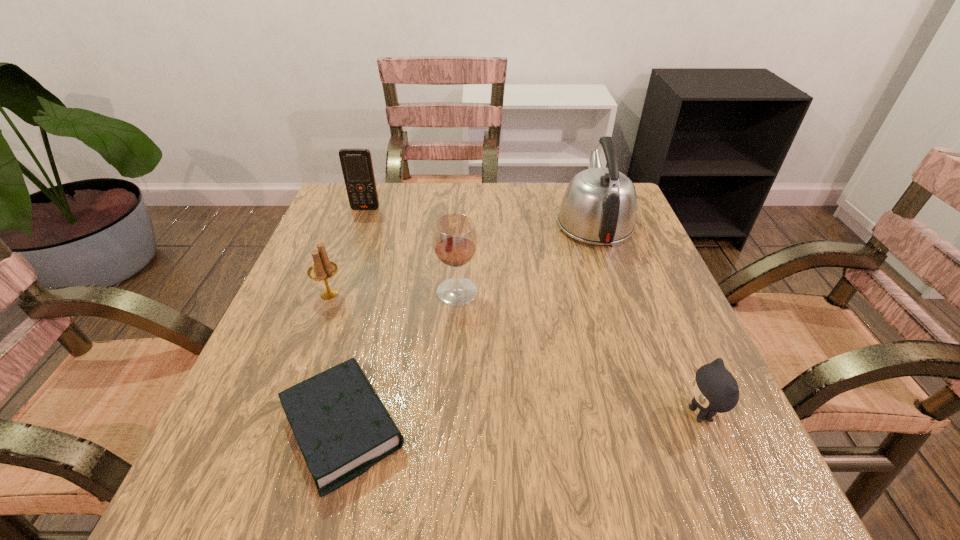
Identify the location of kettle. The width and height of the screenshot is (960, 540). (599, 206).

You are a GUI agent. You are given a task and a screenshot of the screen. Output one action in this format:
    pyautogui.click(x=<x>, y=<y>)
    Task: Click on the wineglass
    This screenshot has width=960, height=540.
    Given the screenshot: What is the action you would take?
    pyautogui.click(x=454, y=237)

Identify the location of cellular telephone. The image size is (960, 540). (356, 163).

Where is `candle holder`? The height and width of the screenshot is (540, 960). candle holder is located at coordinates (322, 269).

Where is `the fifth tallest object`? the fifth tallest object is located at coordinates (715, 390).

Find the location of a particular element. This screenshot has height=540, width=960. the shortest object is located at coordinates (342, 427).

Image resolution: width=960 pixels, height=540 pixels. Find the location of `vacant position located 0.090m on the spout of the kettle`. vacant position located 0.090m on the spout of the kettle is located at coordinates (580, 182).

Locate an element on the screen. The image size is (960, 540). free region located on the spout of the kettle is located at coordinates (583, 190).

Where is `vacant space located 0.360m on the right of the wineglass`? This screenshot has height=540, width=960. vacant space located 0.360m on the right of the wineglass is located at coordinates (652, 292).

This screenshot has height=540, width=960. What are the coordinates of `free region located 0.270m on the screen of the cellular telephone` in the screenshot? It's located at (340, 279).